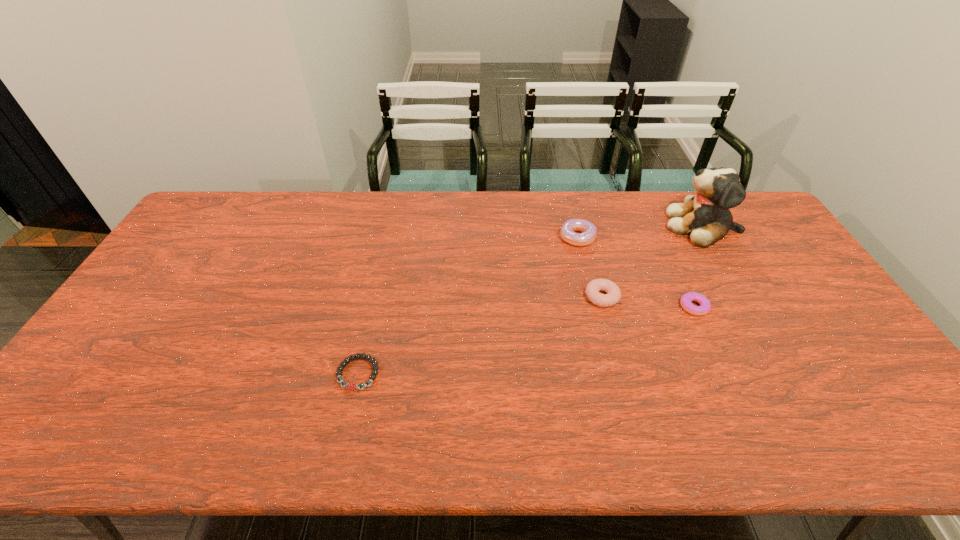
Find the location of a particular element. The image size is (960, 540). puppy is located at coordinates (706, 217).

Find the location of a particular element. This screenshot has height=540, width=960. the second tallest object is located at coordinates (588, 229).

The image size is (960, 540). I want to click on the tallest doughnut, so click(x=588, y=229).

Locate an element on the screen. The width and height of the screenshot is (960, 540). the second tallest doughnut is located at coordinates (613, 295).

Identify the location of the shortest doughnut. (705, 306).

Identify the location of the rightmost doughnut. Image resolution: width=960 pixels, height=540 pixels. (705, 306).

Where is `the leftmost object`? This screenshot has width=960, height=540. the leftmost object is located at coordinates (351, 385).

Find the location of `the nearest object`. the nearest object is located at coordinates (351, 385).

Image resolution: width=960 pixels, height=540 pixels. Identify the location of free space located 0.210m at the face of the puppy. (604, 226).

Where is `vacant space located at the face of the puppy`? The image size is (960, 540). vacant space located at the face of the puppy is located at coordinates (587, 226).